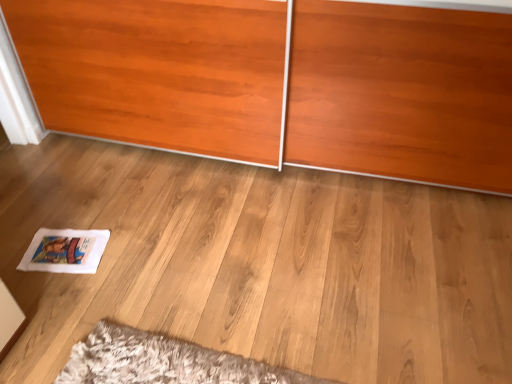
What do you see at coordinates (65, 251) in the screenshot?
I see `white paper magazine at lower left` at bounding box center [65, 251].

Identify the location of white paper magazine at lower left. (65, 251).

Find the location of a particular element. The width and height of the screenshot is (512, 384). matte wood wardrobe at center is located at coordinates 281,82.

What do you see at coordinates (281, 82) in the screenshot? I see `matte wood wardrobe at center` at bounding box center [281, 82].

Find the location of a particular element. The width and height of the screenshot is (512, 384). white paper magazine at lower left is located at coordinates (65, 251).

Considering the relative positions of matte wood wardrobe at center and white paper magazine at lower left in the image provided, is matte wood wardrobe at center to the left or to the right of white paper magazine at lower left?

In the image, matte wood wardrobe at center appears on the right side of white paper magazine at lower left.

Is the depth of matte wood wardrobe at center less than that of white paper magazine at lower left?

Yes, the depth of matte wood wardrobe at center is less than that of white paper magazine at lower left.

Is point (127, 136) positioned in front of point (53, 250)?

That is False.

From the image's perspective, between matte wood wardrobe at center and white paper magazine at lower left, which one is located above?

matte wood wardrobe at center appears higher in the image.

From a real-world perspective, is matte wood wardrobe at center on white paper magazine at lower left?

Yes, from a real-world perspective, matte wood wardrobe at center is on top of white paper magazine at lower left.

In the scene shown: Does matte wood wardrobe at center have a lesser width compared to white paper magazine at lower left?

Incorrect, the width of matte wood wardrobe at center is not less than that of white paper magazine at lower left.

In the scene shown: Which of these two, matte wood wardrobe at center or white paper magazine at lower left, stands taller?

matte wood wardrobe at center.

Can you confirm if matte wood wardrobe at center is smaller than white paper magazine at lower left?

Actually, matte wood wardrobe at center might be larger than white paper magazine at lower left.

Is matte wood wardrobe at center surrounding white paper magazine at lower left?

That's incorrect, white paper magazine at lower left is not inside matte wood wardrobe at center.

Is there a large distance between matte wood wardrobe at center and white paper magazine at lower left?

Actually, matte wood wardrobe at center and white paper magazine at lower left are a little close together.

Is matte wood wardrobe at center looking in the opposite direction of white paper magazine at lower left?

No.

How many degrees apart are the facing directions of matte wood wardrobe at center and white paper magazine at lower left?

matte wood wardrobe at center and white paper magazine at lower left are facing 11.1 degrees away from each other.

I want to click on furniture above the white paper magazine at lower left (from the image's perspective), so click(x=281, y=82).

Does white paper magazine at lower left appear on the left side of matte wood wardrobe at center?

Indeed, white paper magazine at lower left is positioned on the left side of matte wood wardrobe at center.

Is the depth of white paper magazine at lower left less than that of matte wood wardrobe at center?

No, white paper magazine at lower left is further to the viewer.

Is point (36, 236) farther from camera compared to point (416, 158)?

No, it is not.

From the image's perspective, is white paper magazine at lower left above matte wood wardrobe at center?

Incorrect, from the image's perspective, white paper magazine at lower left is lower than matte wood wardrobe at center.

From a real-world perspective, is white paper magazine at lower left over matte wood wardrobe at center?

Incorrect, from a real-world perspective, white paper magazine at lower left is lower than matte wood wardrobe at center.

In terms of width, does white paper magazine at lower left look wider or thinner when compared to matte wood wardrobe at center?

In the image, white paper magazine at lower left appears to be more narrow than matte wood wardrobe at center.

Which of these two, white paper magazine at lower left or matte wood wardrobe at center, stands shorter?

white paper magazine at lower left.

Looking at the image, does white paper magazine at lower left seem bigger or smaller compared to matte wood wardrobe at center?

white paper magazine at lower left is smaller than matte wood wardrobe at center.

Can we say white paper magazine at lower left lies outside matte wood wardrobe at center?

Indeed, white paper magazine at lower left is completely outside matte wood wardrobe at center.

Is white paper magazine at lower left far from matte wood wardrobe at center?

white paper magazine at lower left is near matte wood wardrobe at center, not far away.

Is white paper magazine at lower left facing away from matte wood wardrobe at center?

No, white paper magazine at lower left's orientation is not away from matte wood wardrobe at center.

What's the angular difference between white paper magazine at lower left and matte wood wardrobe at center's facing directions?

They differ by 11.1 degrees in their facing directions.

How distant is white paper magazine at lower left from matte wood wardrobe at center?

white paper magazine at lower left and matte wood wardrobe at center are 35.43 inches apart from each other.

What are the coordinates of `furniture on the right of white paper magazine at lower left` in the screenshot? It's located at (281, 82).

What are the coordinates of `furniture that is on the right side of white paper magazine at lower left` in the screenshot? It's located at (281, 82).

What are the coordinates of `magazine below the matte wood wardrobe at center (from a real-world perspective)` in the screenshot? It's located at (65, 251).